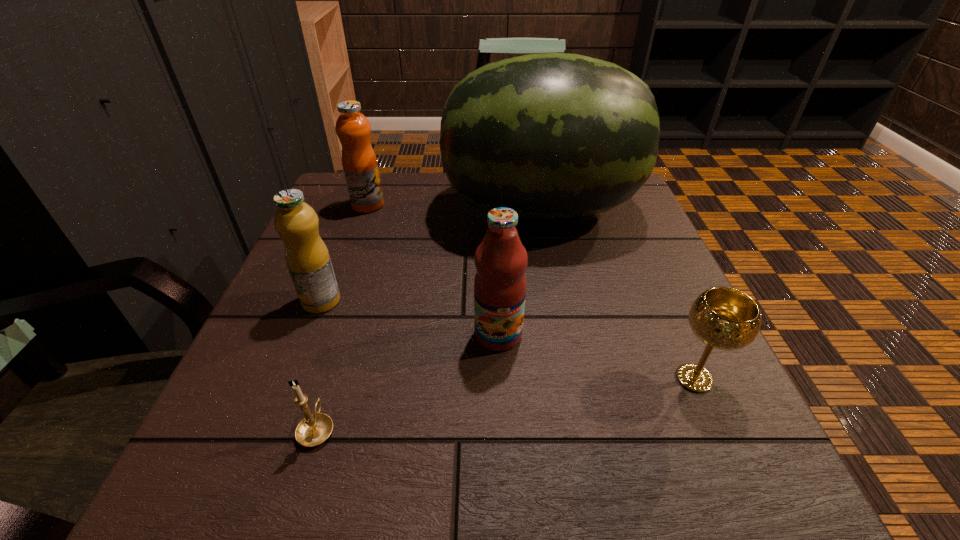
At what (x,y) coordinates should I click in order to perform the action: click on vacant space located on the right of the farthest fruit juice. Please return your answer as a coordinate pair (x, y). Looking at the image, I should click on (512, 205).

Identify the location of vacant space located 0.220m on the front label of the rightmost fruit juice. Image resolution: width=960 pixels, height=540 pixels. (504, 484).

Locate an element on the screen. free space located 0.050m on the front label of the second nearest fruit juice is located at coordinates (308, 335).

The image size is (960, 540). I want to click on free space located 0.090m on the back of the second shortest object, so click(667, 318).

You are a GUI agent. You are given a task and a screenshot of the screen. Output one action in this format:
    pyautogui.click(x=<x>, y=<y>)
    Task: Click on the free space located 0.050m on the handle side of the candle holder
    The width and height of the screenshot is (960, 540).
    Given the screenshot: What is the action you would take?
    pyautogui.click(x=332, y=381)

Identify the location of blank area located on the handle side of the candle holder. (354, 306).

Find the location of a particular element. This screenshot has height=540, width=960. free space located 0.100m on the handle side of the candle holder is located at coordinates (339, 356).

Find the location of a particular element. This screenshot has width=960, height=540. watermelon positioned at the far edge is located at coordinates (551, 135).

Where is `fruit juice located at the far edge`? fruit juice located at the far edge is located at coordinates (353, 129).

The width and height of the screenshot is (960, 540). In order to click on object that is at the near edge in this screenshot , I will do `click(314, 429)`.